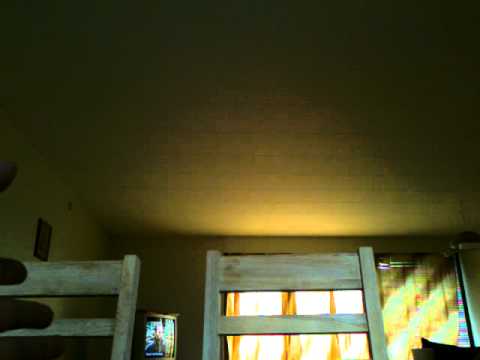
The image size is (480, 360). Identify the location of edge of ceiling. (169, 236).